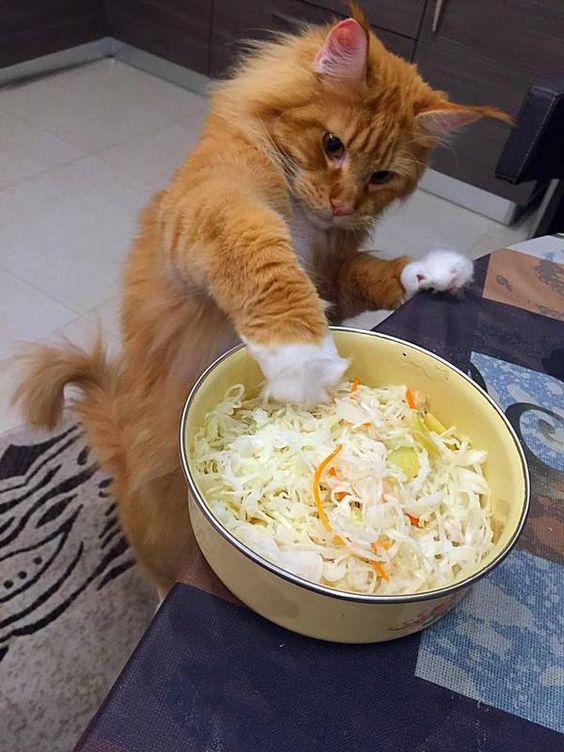
You are a GUI agent. You are given a task and a screenshot of the screen. Output one action in this format:
    pyautogui.click(x=<x>, y=<y>)
    Task: Click on the light gray floor
    The width and height of the screenshot is (564, 752).
    Given the screenshot: What is the action you would take?
    pyautogui.click(x=81, y=177)